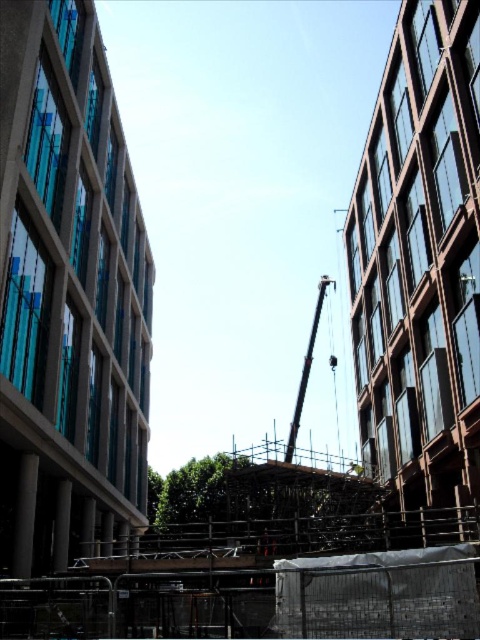
Can you confirm if wooden scaffolding at center is wider than metallic gray crane at center?

Indeed, wooden scaffolding at center has a greater width compared to metallic gray crane at center.

Where is `wooden scaffolding at center`? The width and height of the screenshot is (480, 640). wooden scaffolding at center is located at coordinates (264, 582).